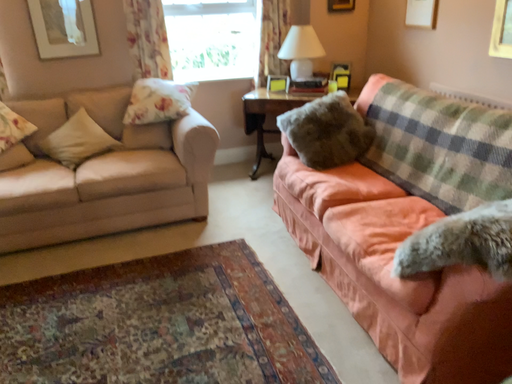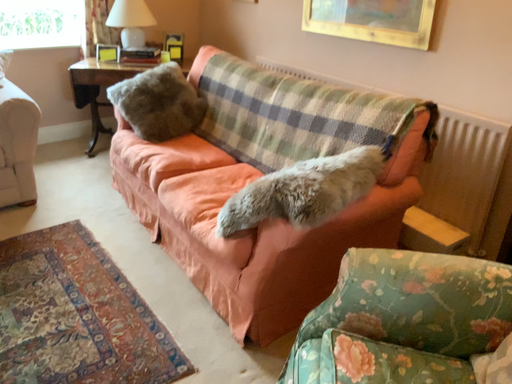
Question: How did the camera likely rotate when shooting the video?

Choices:
 (A) rotated left
 (B) rotated right

Answer: (B)